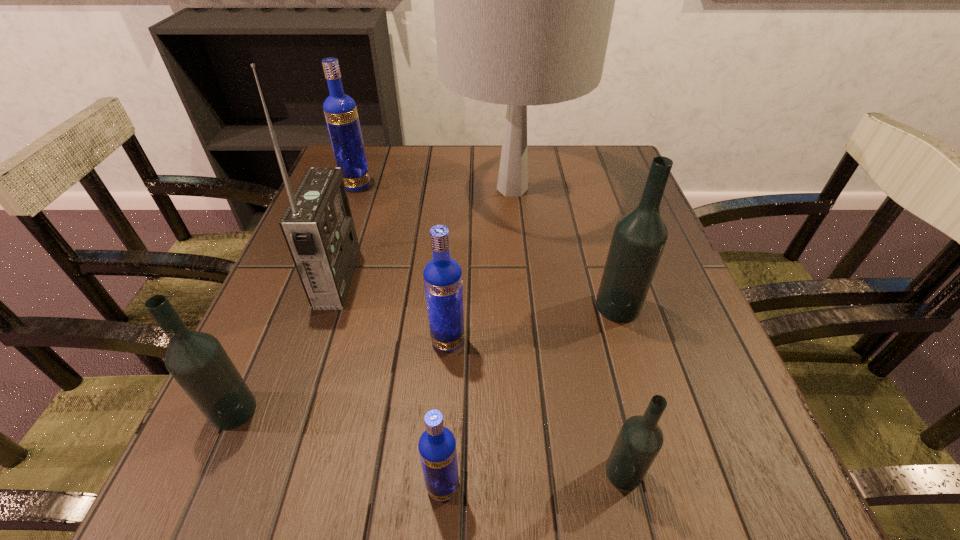
At what (x,y) coordinates should I click in order to perform the action: click on lampshade. Please return your answer as a coordinate pair (x, y). Looking at the image, I should click on (523, 0).

Where is `radio receiver`? radio receiver is located at coordinates (318, 227).

The height and width of the screenshot is (540, 960). I want to click on the farthest vodka, so click(340, 110).

Where is `the farthest blue vodka`? This screenshot has height=540, width=960. the farthest blue vodka is located at coordinates (340, 110).

This screenshot has width=960, height=540. I want to click on the farthest black vodka, so click(x=639, y=237).

The image size is (960, 540). Find the location of `the second farthest vodka`. the second farthest vodka is located at coordinates (639, 237).

The height and width of the screenshot is (540, 960). Identify the location of the fifth farthest object. (442, 275).

Identify the location of the second nearest blue vodka. This screenshot has height=540, width=960. (442, 275).

Identify the location of the sixth farthest object. (197, 361).

Locate an element on the screen. This screenshot has height=540, width=960. the second smallest black vodka is located at coordinates (197, 361).